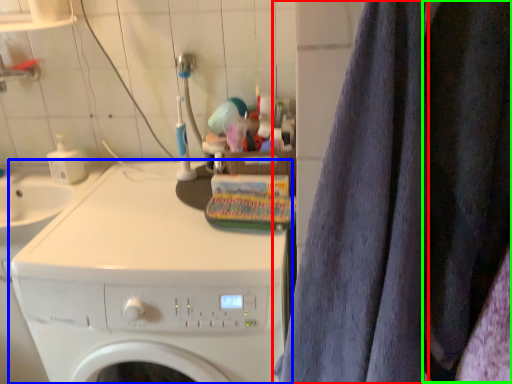
Question: Based on their relative distances, which object is farther from bath towel (highlighted by a red box)? Choose from washing machine (highlighted by a blue box) and clothing (highlighted by a green box).

Choices:
 (A) washing machine
 (B) clothing

Answer: (A)